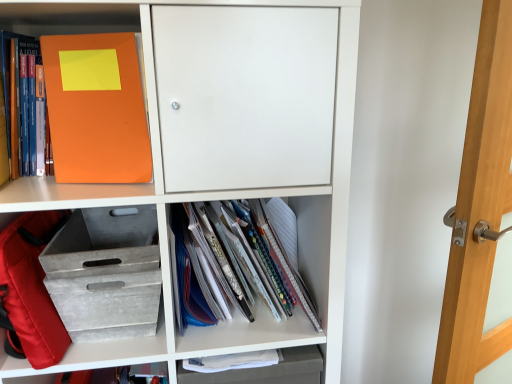
Question: Does transparent glass door at right appear on the left side of gray textured crate at lower left, acting as the 1th shelf starting from the bottom?

Choices:
 (A) yes
 (B) no

Answer: (B)

Question: Is transparent glass door at right thinner than gray textured crate at lower left, arranged as the 3th shelf when viewed from the top?

Choices:
 (A) yes
 (B) no

Answer: (A)

Question: Is transparent glass door at right at the right side of gray textured crate at lower left, arranged as the 3th shelf when viewed from the top?

Choices:
 (A) no
 (B) yes

Answer: (B)

Question: Does transparent glass door at right touch gray textured crate at lower left, arranged as the 3th shelf when viewed from the top?

Choices:
 (A) no
 (B) yes

Answer: (A)

Question: From a real-world perspective, is transparent glass door at right on gray textured crate at lower left, acting as the 1th shelf starting from the bottom?

Choices:
 (A) yes
 (B) no

Answer: (B)

Question: Does transparent glass door at right have a greater width compared to gray textured crate at lower left, arranged as the 3th shelf when viewed from the top?

Choices:
 (A) no
 (B) yes

Answer: (A)

Question: From a real-world perspective, is red fabric backpack at lower left positioned under orange matte folder at upper left, the first shelf when ordered from top to bottom, based on gravity?

Choices:
 (A) no
 (B) yes

Answer: (B)

Question: Is red fabric backpack at lower left facing towards orange matte folder at upper left, positioned as the 3th shelf in bottom-to-top order?

Choices:
 (A) no
 (B) yes

Answer: (A)

Question: From a real-world perspective, is red fabric backpack at lower left positioned over orange matte folder at upper left, the first shelf when ordered from top to bottom, based on gravity?

Choices:
 (A) no
 (B) yes

Answer: (A)

Question: Does red fabric backpack at lower left have a lesser height compared to orange matte folder at upper left, positioned as the 3th shelf in bottom-to-top order?

Choices:
 (A) no
 (B) yes

Answer: (B)

Question: Is the position of red fabric backpack at lower left less distant than that of orange matte folder at upper left, the first shelf when ordered from top to bottom?

Choices:
 (A) no
 (B) yes

Answer: (A)

Question: Does red fabric backpack at lower left have a lesser width compared to orange matte folder at upper left, the first shelf when ordered from top to bottom?

Choices:
 (A) no
 (B) yes

Answer: (A)

Question: Can you confirm if orange matte folder at upper left, arranged as the second shelf when ordered from the bottom, is wider than orange matte folder at upper left, marked as the 2th book in a bottom-to-top arrangement?

Choices:
 (A) yes
 (B) no

Answer: (A)